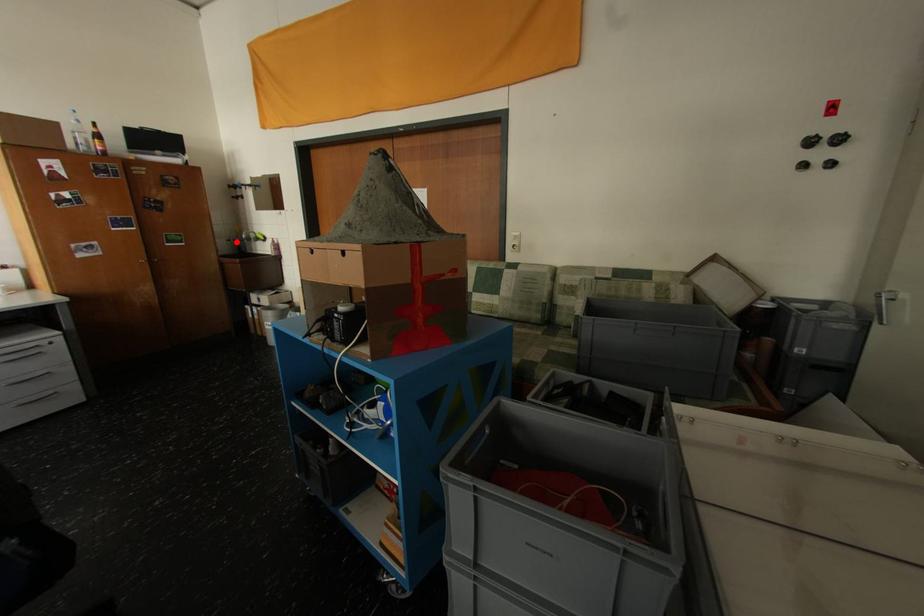
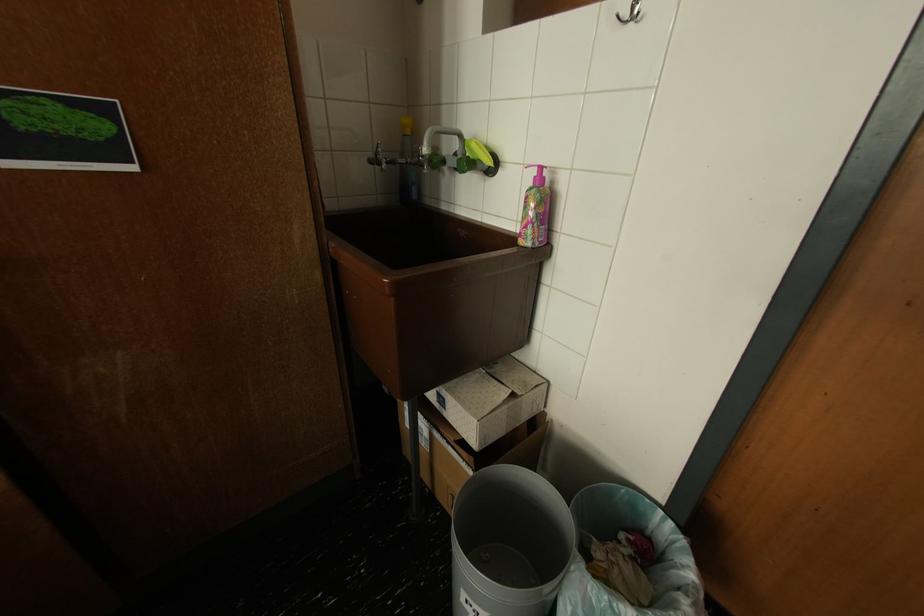
Question: I am providing you with two images of the same scene from different viewpoints. Given a red point in image1, look at the same physical point in image2. Is it:

Choices:
 (A) Closer to the viewpoint
 (B) Farther from the viewpoint

Answer: (B)